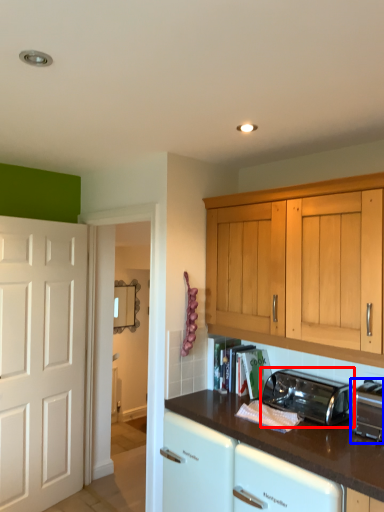
Question: Which of the following is the closest to the observer, toaster (highlighted by a red box) or toaster (highlighted by a blue box)?

Choices:
 (A) toaster
 (B) toaster

Answer: (B)